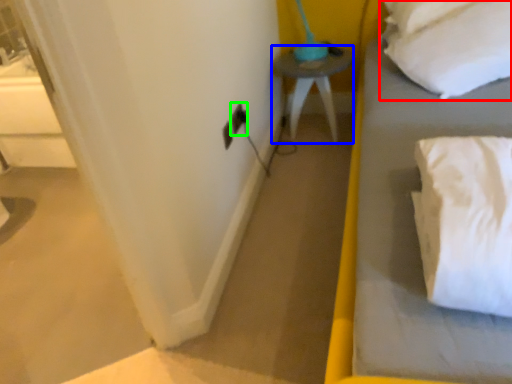
Question: Which is farther away from pillow (highlighted by a red box)? furniture (highlighted by a blue box) or electric outlet (highlighted by a green box)?

Choices:
 (A) furniture
 (B) electric outlet

Answer: (B)